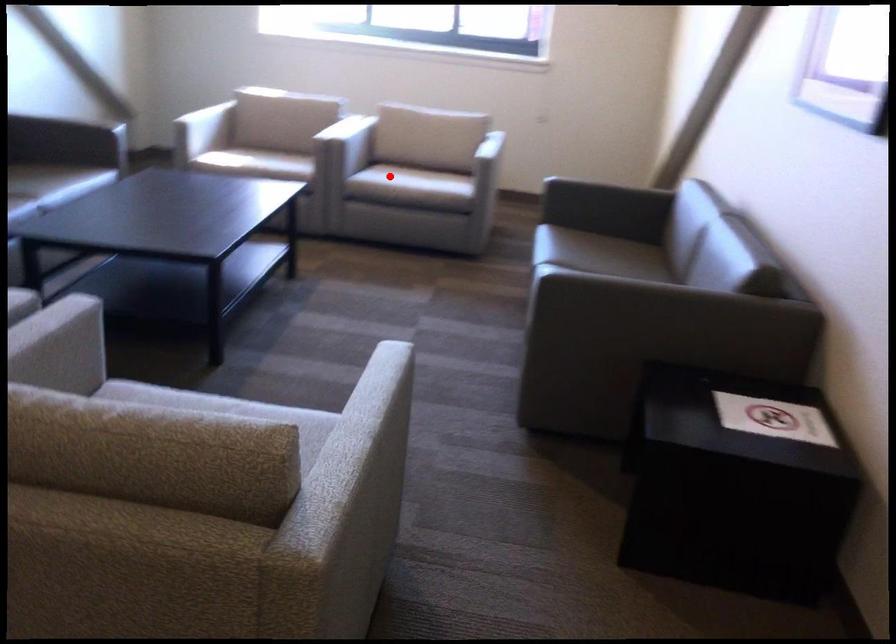
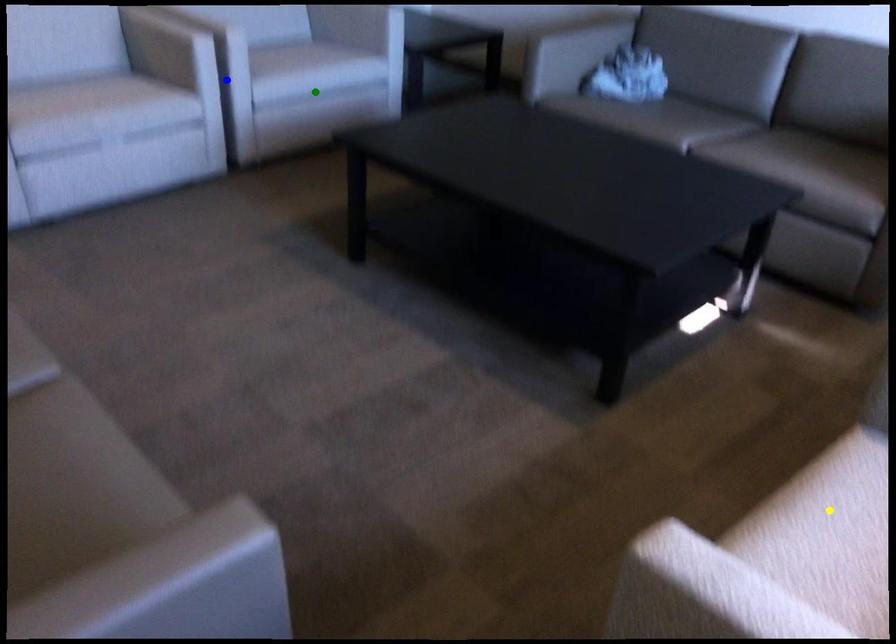
Question: I am providing you with two images of the same scene from different viewpoints. A red point is marked on the first image. You are given multiple points on the second image. Which point in image 2 is actually the same real-world point as the red point in image 1?

Choices:
 (A) yellow point
 (B) green point
 (C) blue point

Answer: (A)